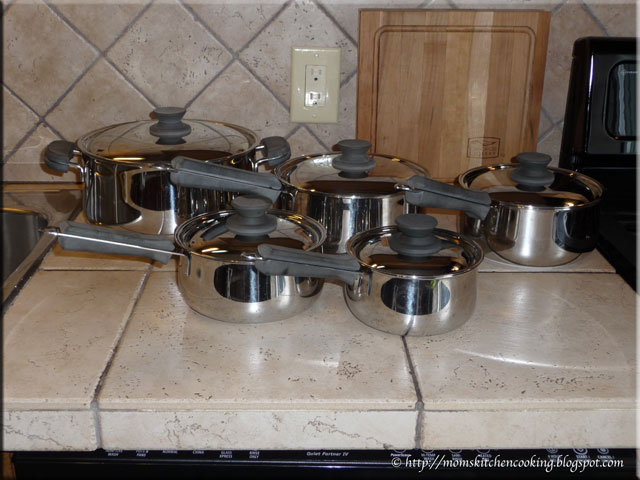
The width and height of the screenshot is (640, 480). In order to click on handle of lid in this screenshot , I will do `click(236, 212)`, `click(347, 156)`.